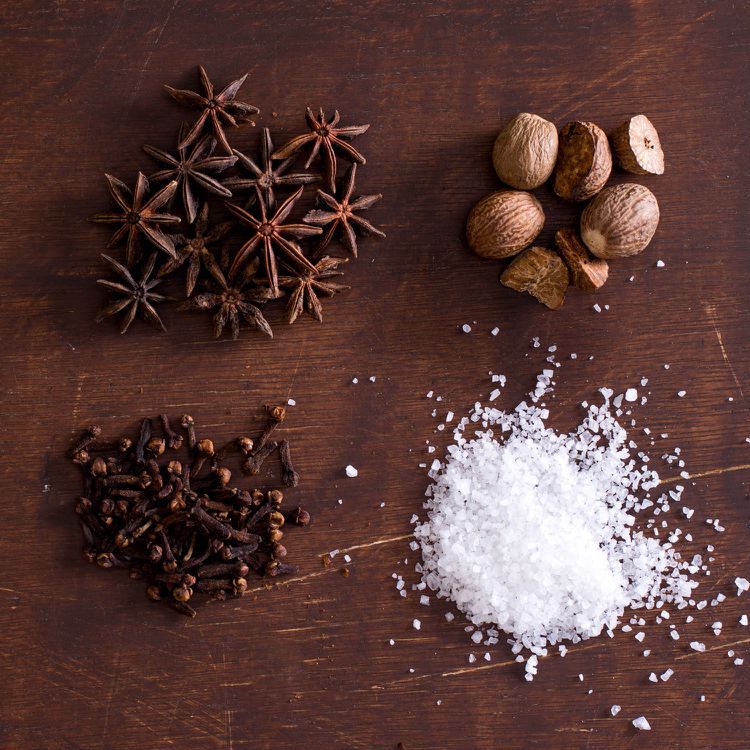
Locate an element on the screen. table is located at coordinates (412, 296).